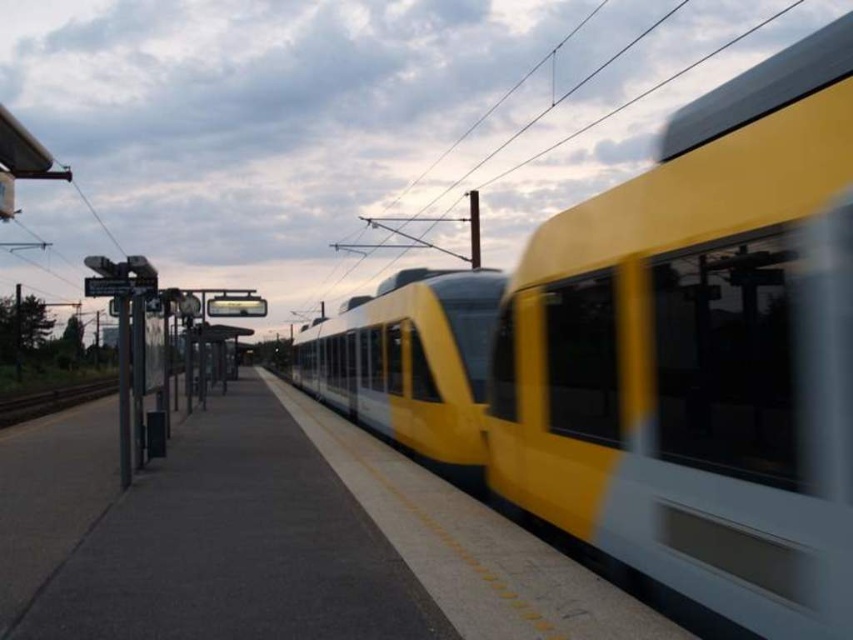
Does yellow matte train at center have a greater width compared to brown wooden train track at lower left?

In fact, yellow matte train at center might be narrower than brown wooden train track at lower left.

Does yellow matte train at center have a greater height compared to brown wooden train track at lower left?

Yes, yellow matte train at center is taller than brown wooden train track at lower left.

Who is more distant from viewer, (850, 486) or (16, 410)?

The point (16, 410) is more distant.

Locate an element on the screen. This screenshot has height=640, width=853. yellow matte train at center is located at coordinates (697, 355).

Is smooth concrete platform at center to the right of brown wooden train track at lower left from the viewer's perspective?

Indeed, smooth concrete platform at center is positioned on the right side of brown wooden train track at lower left.

From the picture: Between smooth concrete platform at center and brown wooden train track at lower left, which one has more height?

Standing taller between the two is brown wooden train track at lower left.

This screenshot has height=640, width=853. In order to click on smooth concrete platform at center in this screenshot , I will do `click(271, 538)`.

Which is more to the left, yellow matte train at center or smooth concrete platform at center?

smooth concrete platform at center

This screenshot has width=853, height=640. Describe the element at coordinates (697, 355) in the screenshot. I see `yellow matte train at center` at that location.

The width and height of the screenshot is (853, 640). Find the location of `yellow matte train at center`. yellow matte train at center is located at coordinates (697, 355).